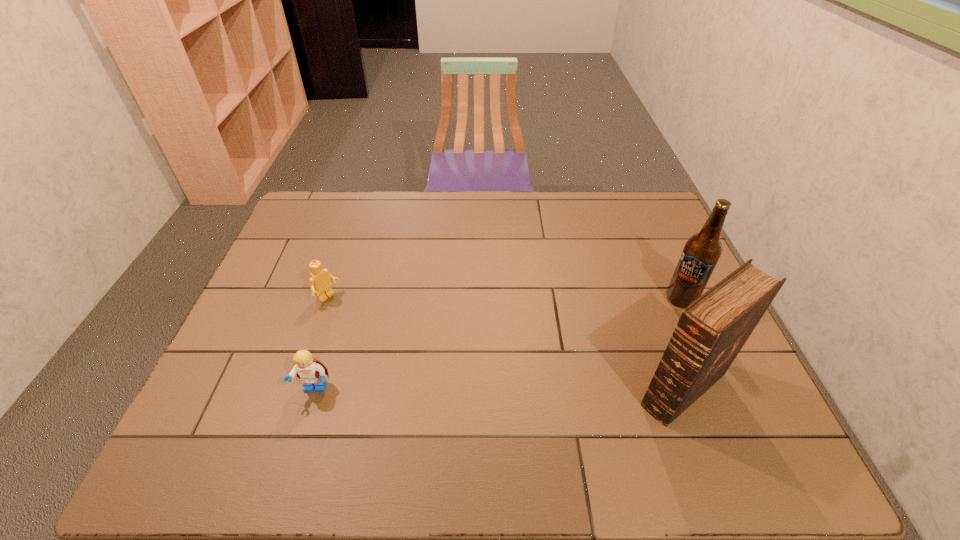
You are a GUI agent. You are given a task and a screenshot of the screen. Output one action in this format:
    pyautogui.click(x=<x>, y=<y>)
    Task: Click on the vacant space at the near left corner
    Image resolution: width=960 pixels, height=540 pixels.
    Given the screenshot: What is the action you would take?
    pyautogui.click(x=251, y=404)

Find the location of a particular element. The image size is (960, 540). free point at the far right corner is located at coordinates (620, 193).

This screenshot has width=960, height=540. What are the coordinates of `vacant area that lies between the farther Lego and the Bible` in the screenshot? It's located at pyautogui.click(x=506, y=344).

You are a GUI agent. You are given a task and a screenshot of the screen. Output one action in this format:
    pyautogui.click(x=<x>, y=<y>)
    Task: Click on the unoccupied position between the farther Lego and the beer bottle
    The image size is (960, 540).
    Given the screenshot: What is the action you would take?
    pyautogui.click(x=505, y=299)

The width and height of the screenshot is (960, 540). What are the coordinates of `vacant space that is in between the beer bottle and the nearer Lego` in the screenshot? It's located at (498, 344).

Find the location of a particular element. This screenshot has width=960, height=540. free spot between the nearer Lego and the Bible is located at coordinates (499, 389).

The height and width of the screenshot is (540, 960). In order to click on free space between the Bible and the farther Lego in this screenshot , I will do `click(506, 344)`.

Identify the location of free spot between the nearer Lego and the farther Lego. This screenshot has width=960, height=540. (322, 344).

Find the location of a particular element. This screenshot has height=540, width=960. free space between the beer bottle and the nearer Lego is located at coordinates (498, 344).

What are the coordinates of `free point between the Bible and the farther Lego` in the screenshot? It's located at (506, 344).